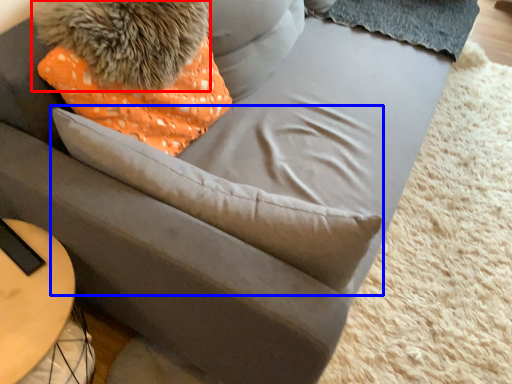
Question: Which object appears farthest to the camera in this image, animal (highlighted by a red box) or throw pillow (highlighted by a blue box)?

Choices:
 (A) animal
 (B) throw pillow

Answer: (A)